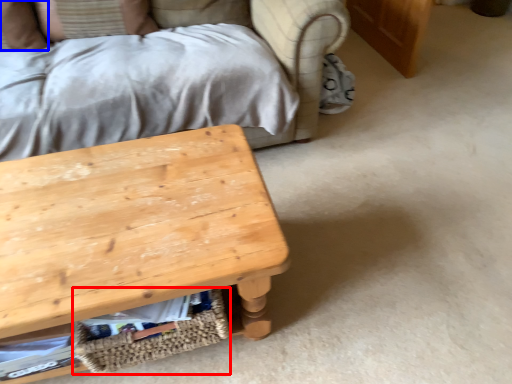
Question: Which point is closer to the camera, basket (highlighted by a red box) or pillow (highlighted by a blue box)?

Choices:
 (A) basket
 (B) pillow

Answer: (A)